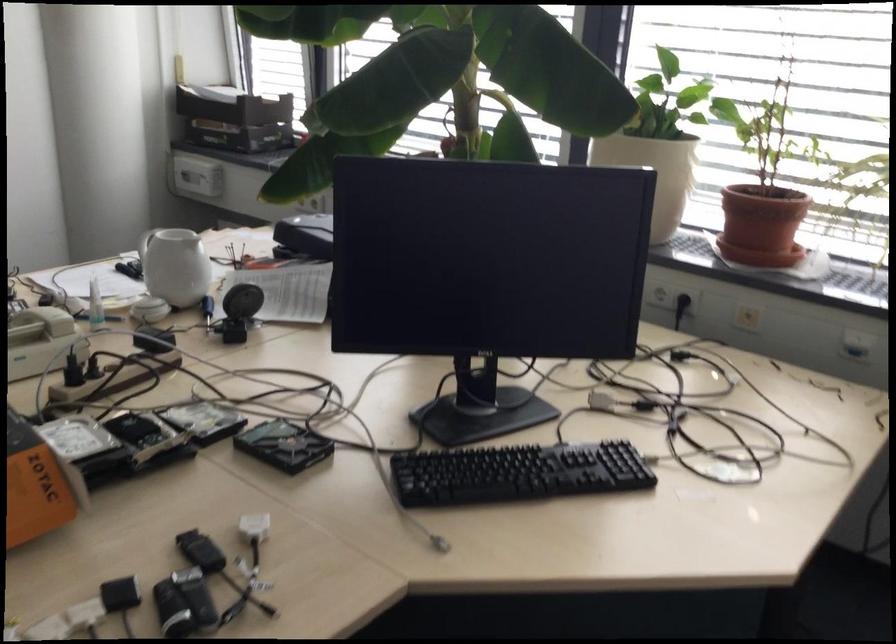
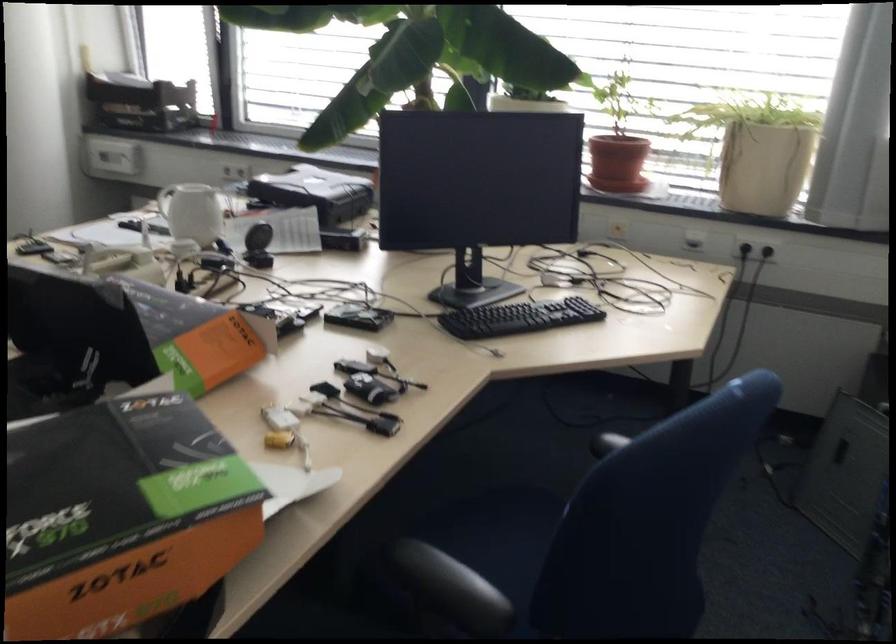
Where in the second image is the point corresponding to point 748,234 from the first image?

(616, 163)